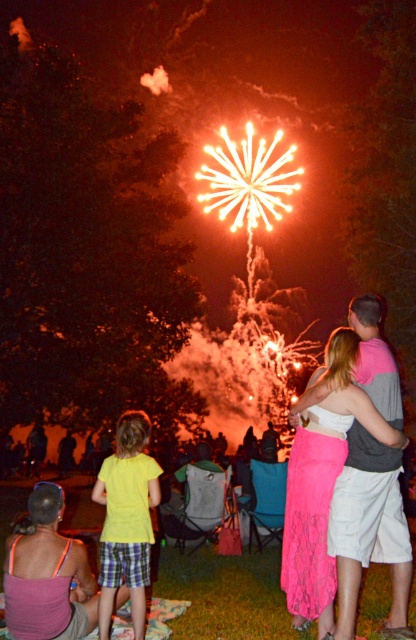
Question: Among these points, which one is farthest from the camera?

Choices:
 (A) (319, 376)
 (B) (138, 621)

Answer: (A)

Question: Is yellow cotton shirt at lower left bigger than pink lace skirt at center?

Choices:
 (A) no
 (B) yes

Answer: (B)

Question: Does yellow cotton shirt at lower left appear on the left side of pink lace skirt at center?

Choices:
 (A) no
 (B) yes

Answer: (B)

Question: Is yellow cotton shirt at lower left thinner than pink lace skirt at center?

Choices:
 (A) no
 (B) yes

Answer: (B)